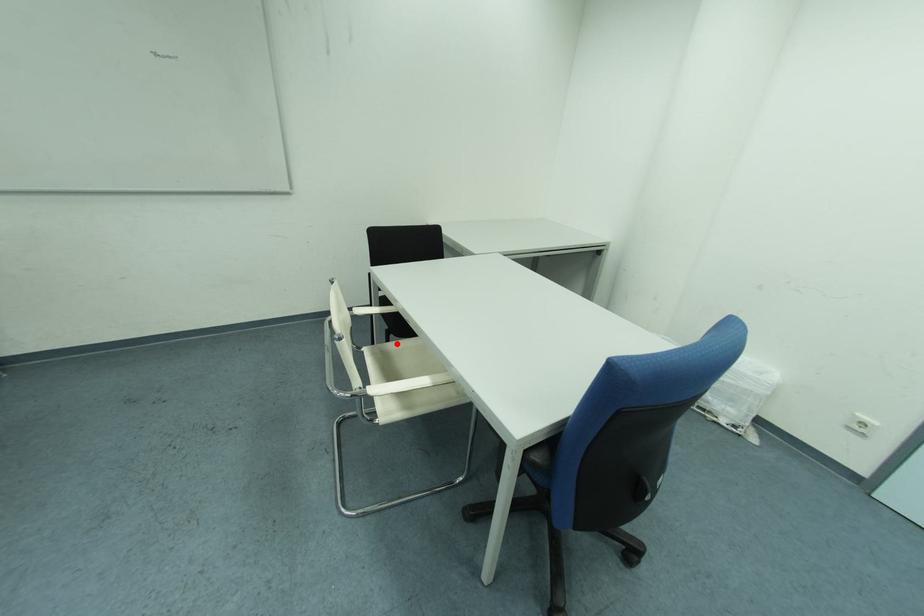
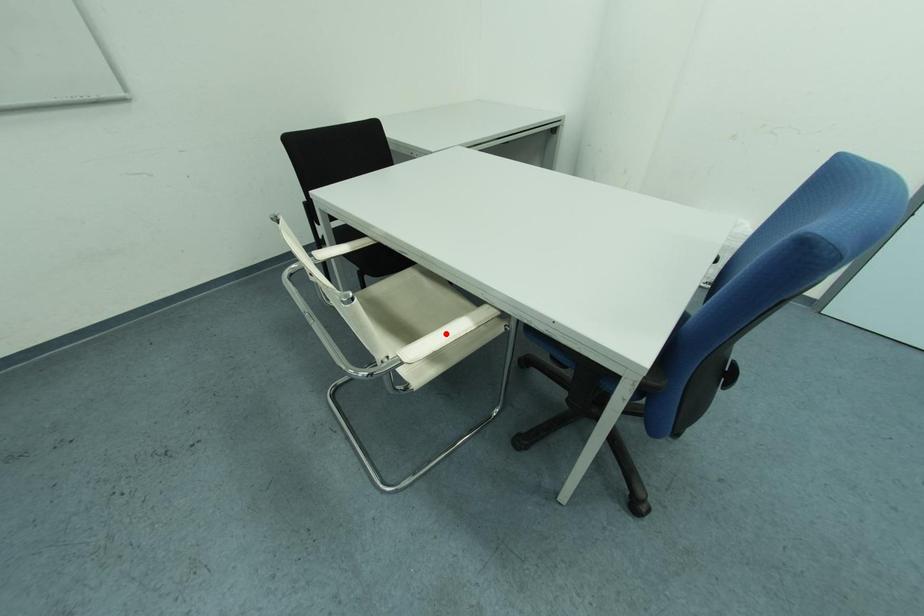
I am providing you with two images of the same scene from different viewpoints. A red point is marked on the first image and another point is marked on the second image. Is the marked point in image1 the same physical position as the marked point in image2?

No